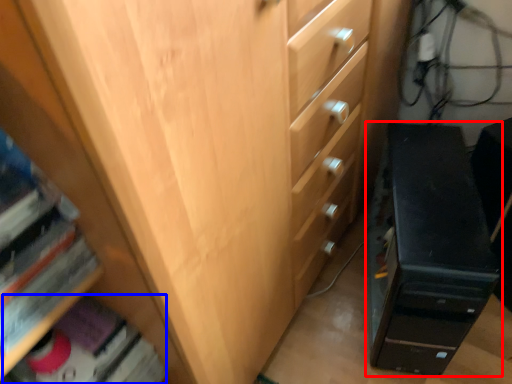
Question: Which object is further to the camera taking this photo, chest of drawers (highlighted by a red box) or book (highlighted by a blue box)?

Choices:
 (A) chest of drawers
 (B) book

Answer: (A)